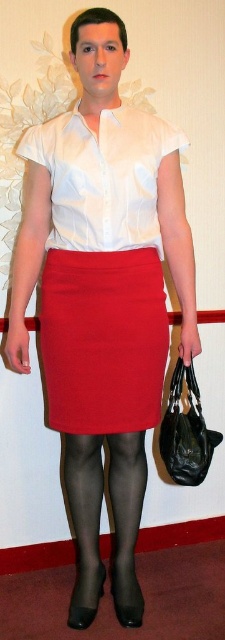
You are a fashion designer observing the outfit of the person in the image. Which item is placed above the other between the matte red skirt at center and the black sheer tights at lower center?

The matte red skirt at center is positioned over the black sheer tights at lower center.

You are a fashion designer observing the outfit of the person in the image. Which item is positioned closer to the front of the outfit, the matte red skirt at center or the black sheer tights at lower center?

The matte red skirt at center is closer to the viewer than the black sheer tights at lower center, so the matte red skirt at center is positioned closer to the front of the outfit.

You are a fashion designer analyzing the image. You need to locate the exact position of the matte red skirt at center. What are its coordinates?

The coordinates of the matte red skirt at center are at point (103, 340).